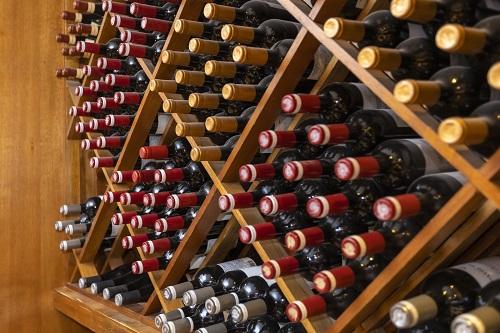
Identify the location of wine bottles in the top right. (337, 30), (371, 56), (401, 12), (447, 39), (494, 69), (451, 132), (412, 90).